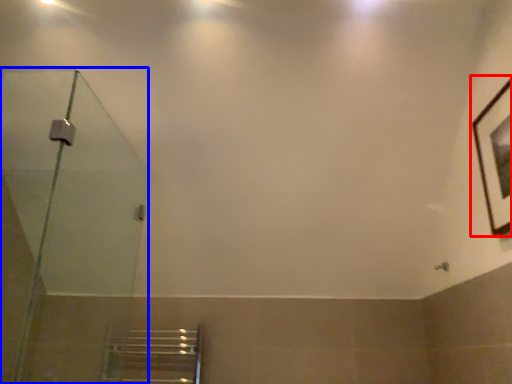
Question: Which point is further to the camera, picture frame (highlighted by a red box) or shower door (highlighted by a blue box)?

Choices:
 (A) picture frame
 (B) shower door

Answer: (A)